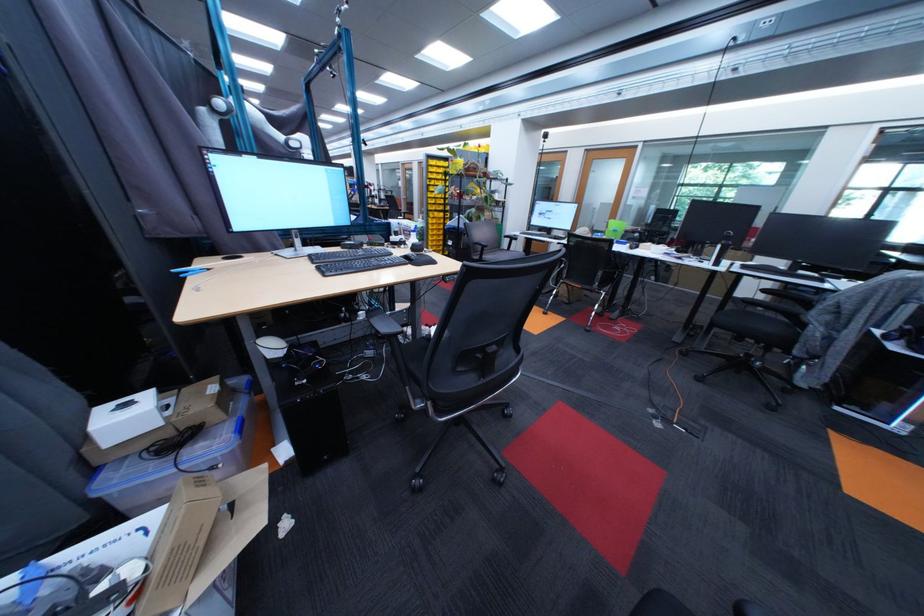
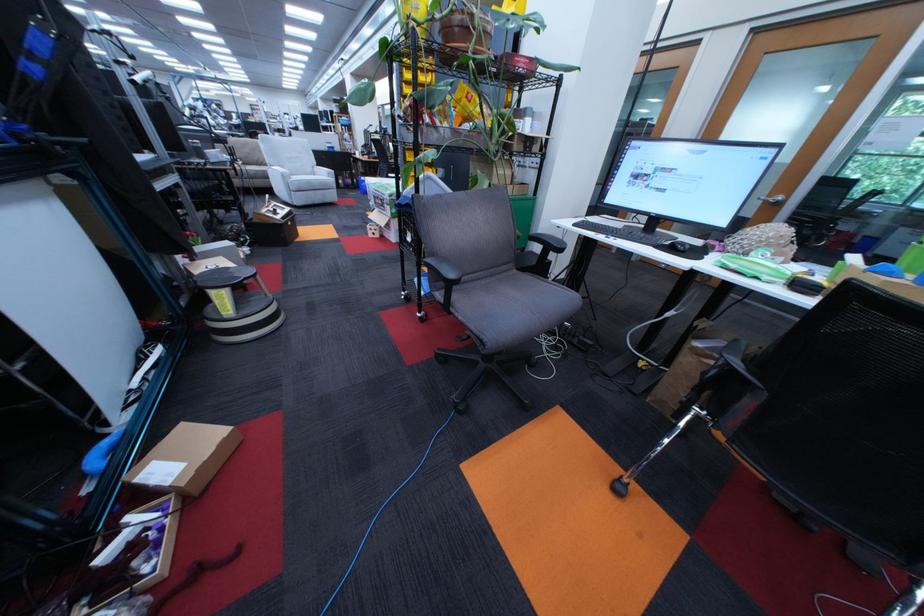
Locate, in the second image, the point that corresponds to (x=521, y=241) in the first image.

(552, 249)